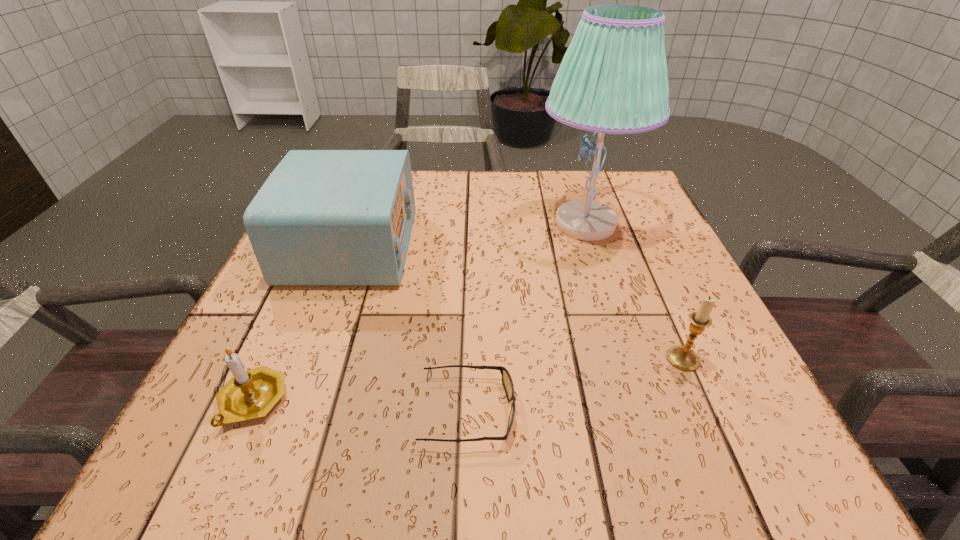
You are a GUI agent. You are given a task and a screenshot of the screen. Output one action in this format:
    pyautogui.click(x=<x>, y=<y>)
    Task: Click on the lamp
    This screenshot has width=960, height=540.
    Given the screenshot: What is the action you would take?
    pyautogui.click(x=613, y=79)

The height and width of the screenshot is (540, 960). I want to click on the fourth shortest object, so click(323, 217).

Identify the location of the taller candle holder. (684, 358).

You are a GUI agent. You are given a task and a screenshot of the screen. Output one action in this format:
    pyautogui.click(x=<x>, y=<y>)
    Task: Click on the third shortest object
    The width and height of the screenshot is (960, 540).
    Given the screenshot: What is the action you would take?
    pyautogui.click(x=684, y=358)

The image size is (960, 540). What are the coordinates of `the fourth tallest object` in the screenshot? It's located at (250, 394).

Where is `the left candle holder`? The width and height of the screenshot is (960, 540). the left candle holder is located at coordinates (250, 394).

Find the location of a particular element. The height and width of the screenshot is (540, 960). the third object from right to left is located at coordinates (507, 382).

Find the location of a particular element. This screenshot has width=960, height=540. the shortest object is located at coordinates (507, 382).

The width and height of the screenshot is (960, 540). I want to click on vacant space located 0.210m on the front of the lamp, so click(x=617, y=324).

The height and width of the screenshot is (540, 960). Identify the location of blank space located on the front panel of the radio receiver. (511, 246).